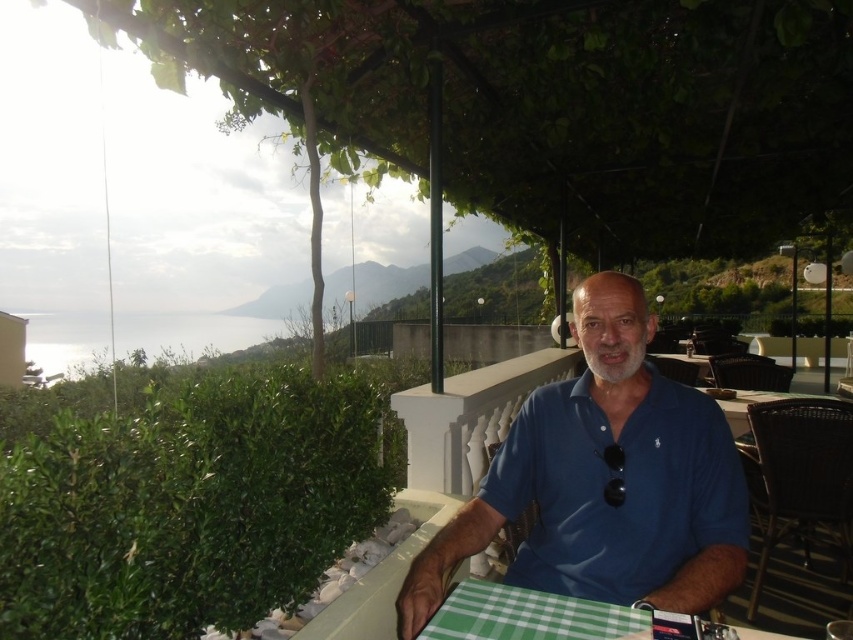
You are a photographer trying to capture a portrait of the person wearing the blue cotton shirt at center and the green checkered tablecloth at lower center. Since you want to focus on the person, which object should you place closer to the camera lens?

The blue cotton shirt at center should be placed closer to the camera lens because it has a greater height compared to the green checkered tablecloth at lower center, making it the primary subject for the portrait.